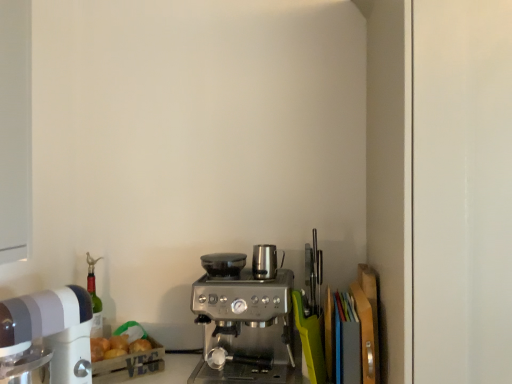
Question: Considering the relative positions of satin silver kettle at center, the 1th appliance in the right-to-left sequence, and satin silver coffee maker at center in the image provided, is satin silver kettle at center, the 1th appliance in the right-to-left sequence, to the left or to the right of satin silver coffee maker at center?

Choices:
 (A) right
 (B) left

Answer: (A)

Question: In terms of height, does satin silver kettle at center, the 1th appliance in the right-to-left sequence, look taller or shorter compared to satin silver coffee maker at center?

Choices:
 (A) tall
 (B) short

Answer: (B)

Question: Estimate the real-world distances between objects in this image. Which object is farther from the satin silver espresso machine at center, the 2th appliance positioned from the right?

Choices:
 (A) satin silver kettle at center, the 1th appliance in the right-to-left sequence
 (B) satin silver coffee maker at center
 (C) white plastic mixer at left

Answer: (C)

Question: Estimate the real-world distances between objects in this image. Which object is closer to the white plastic mixer at left?

Choices:
 (A) satin silver coffee maker at center
 (B) satin silver espresso machine at center, acting as the 1th appliance starting from the left
 (C) satin silver kettle at center, the 1th appliance in the right-to-left sequence

Answer: (B)